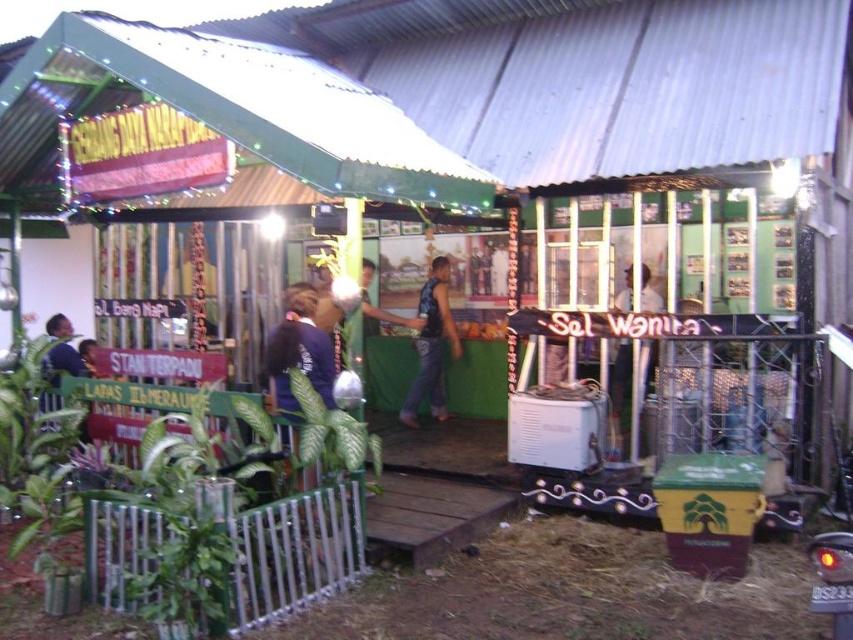
Question: Which point is closer to the camera?

Choices:
 (A) (625, 362)
 (B) (422, 321)

Answer: (A)

Question: Can you confirm if dark blue fabric at center is thinner than dark blue sleeveless shirt at center?

Choices:
 (A) yes
 (B) no

Answer: (A)

Question: Which of these objects is positioned farthest from the dark blue sleeveless shirt at center?

Choices:
 (A) white glossy shirt at center
 (B) dark blue fabric at center

Answer: (B)

Question: Can you confirm if dark blue sleeveless shirt at center is thinner than white glossy shirt at center?

Choices:
 (A) yes
 (B) no

Answer: (B)

Question: Which point is closer to the camera?

Choices:
 (A) (440, 332)
 (B) (654, 301)

Answer: (B)

Question: Is dark blue fabric at center positioned before dark blue sleeveless shirt at center?

Choices:
 (A) no
 (B) yes

Answer: (B)